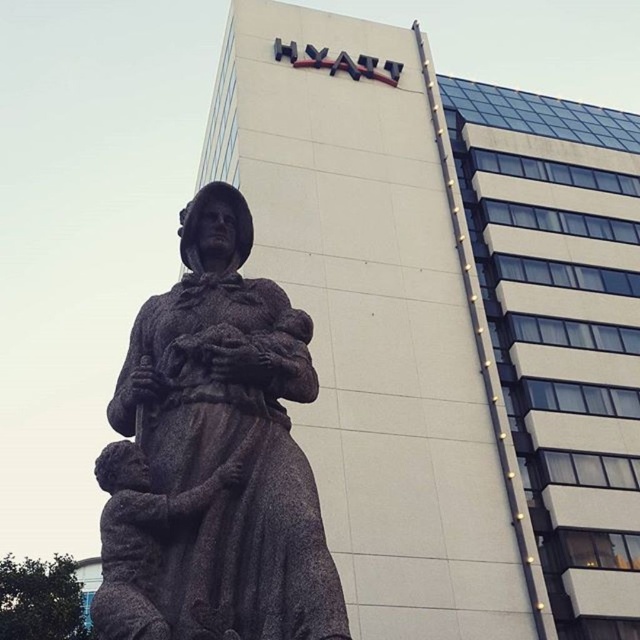
Question: Which object appears farthest from the camera in this image?

Choices:
 (A) rustic stone statue at center
 (B) brown stone statue at center

Answer: (A)

Question: Can you confirm if brown stone statue at center is smaller than rustic stone statue at center?

Choices:
 (A) no
 (B) yes

Answer: (A)

Question: Does brown stone statue at center have a lesser width compared to rustic stone statue at center?

Choices:
 (A) no
 (B) yes

Answer: (A)

Question: Does brown stone statue at center lie in front of rustic stone statue at center?

Choices:
 (A) no
 (B) yes

Answer: (B)

Question: Which point is farther to the camera?

Choices:
 (A) brown stone statue at center
 (B) rustic stone statue at center

Answer: (B)